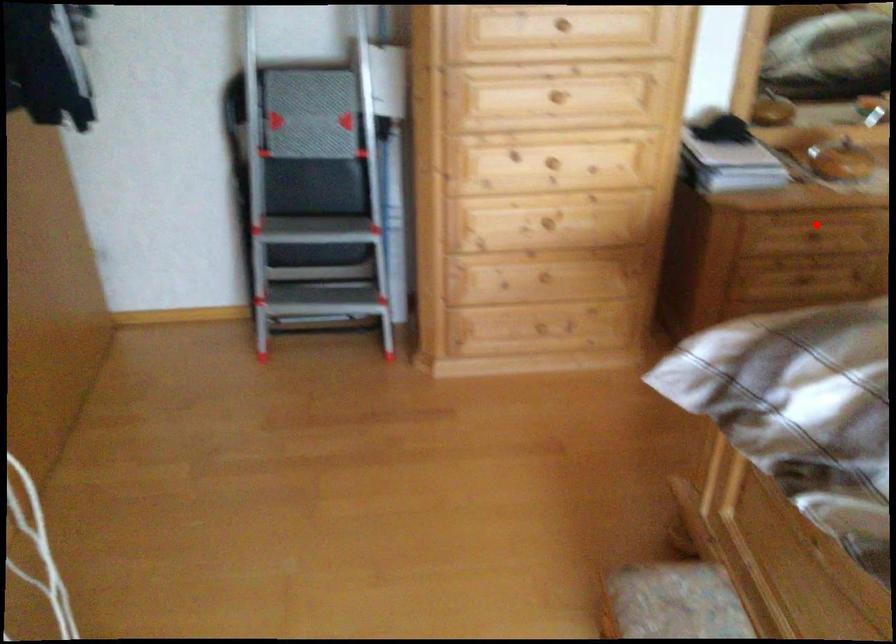
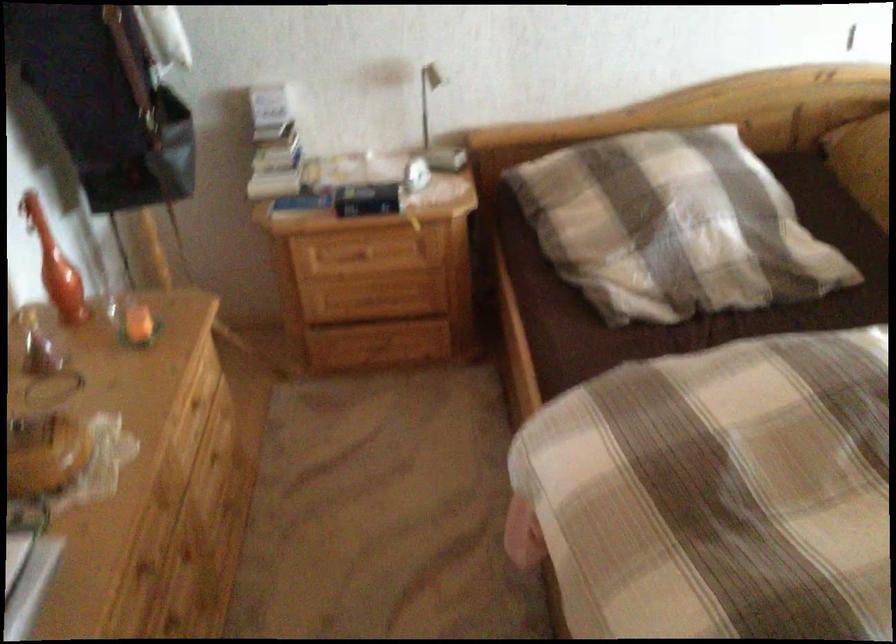
Locate, in the second image, the point that corresponds to the highlighted location in the first image.

(144, 565)